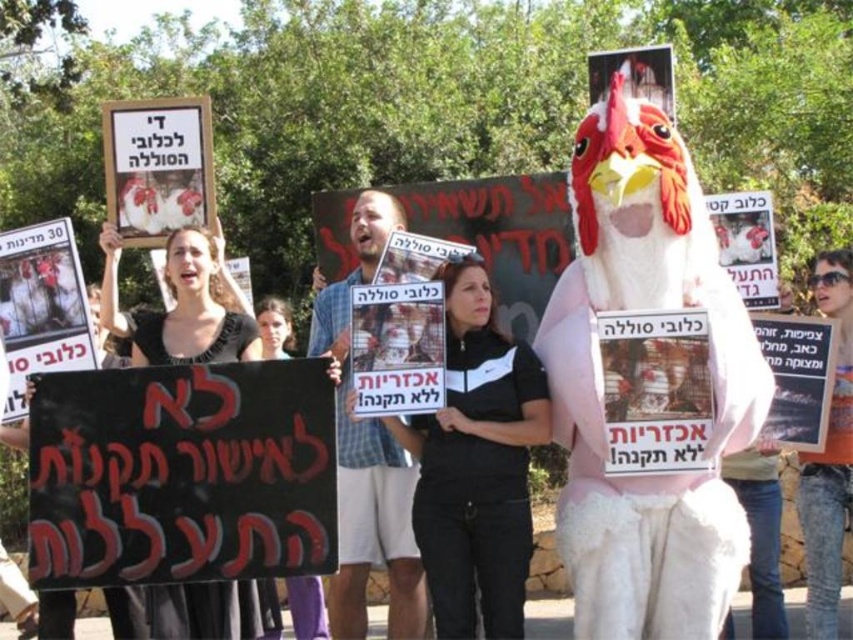
You are standing in the park where the protest is happening. You see two points marked in the image. Which point is closer to you, point (421,611) or point (851,332)?

Point (421,611) is closer to you because it is further to the viewer than point (851,332).